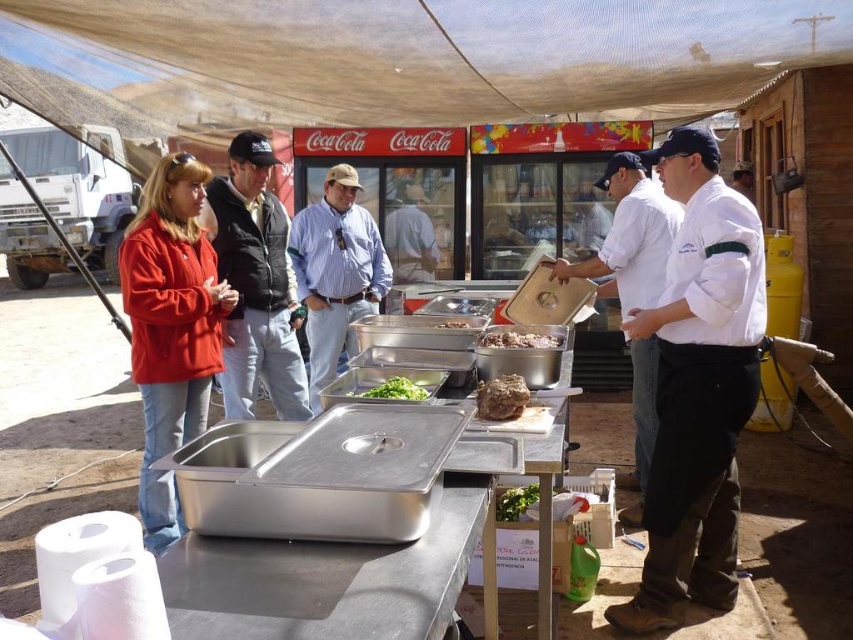
You are a customer at the food service area and want to grab the green leafy vegetables at center. However, there is a light brown leather jacket at center in the way. Can you reach the vegetables without moving the jacket?

The light brown leather jacket at center is taller than the green leafy vegetables at center. Since the jacket is taller, it might block your view or access to the vegetables. You may need to move the jacket to reach them.

You are a customer at the food service setup under the beige canopy. You see a blue striped shirt at center and green leafy vegetables at center. Which object is positioned more to the left?

The blue striped shirt at center is positioned more to the left than the green leafy vegetables at center.